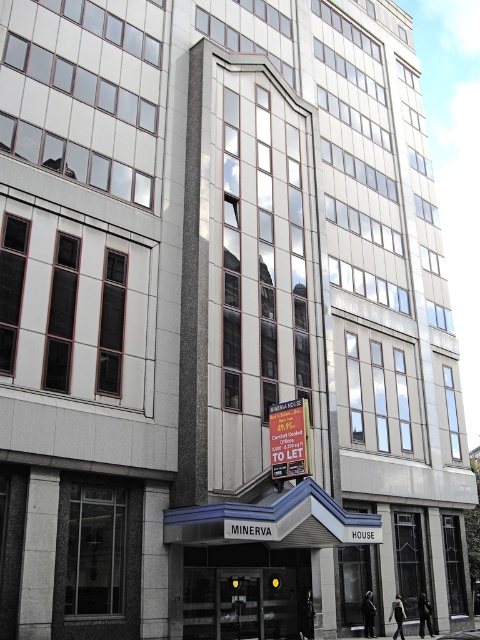
Is transparent glass doors at center wider than yellow paper sign at center?

In fact, transparent glass doors at center might be narrower than yellow paper sign at center.

Which is in front, point (204, 557) or point (280, 452)?

Point (204, 557) is in front.

Identify the location of transparent glass doors at center. The image size is (480, 640). (243, 593).